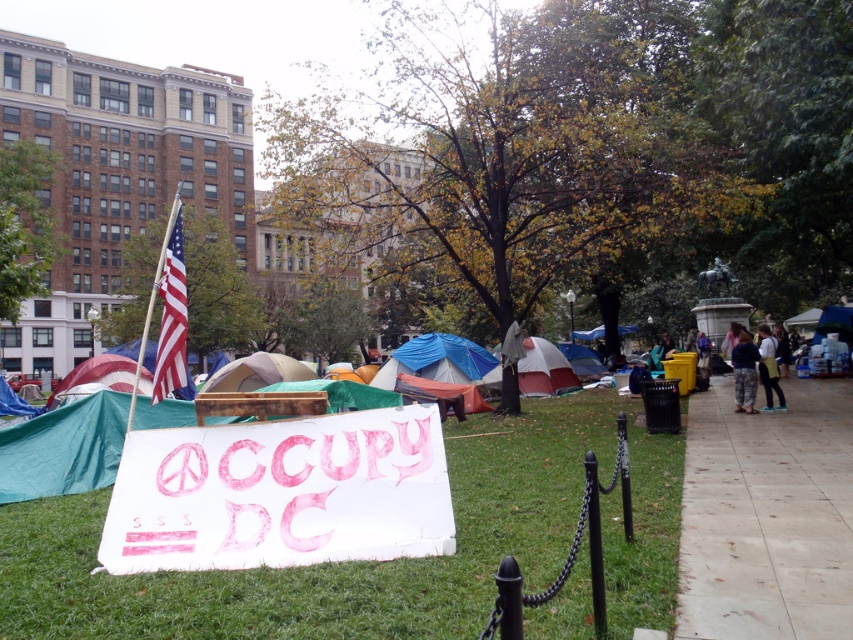
You are a photographer trying to capture the entire scene of the protest in the park. You notice the american flag at upper left and the beige canvas tent at center. Which object should you focus on first to ensure both are in frame without moving the camera?

The american flag at upper left is bigger than the beige canvas tent at center, so you should focus on the american flag at upper left first to ensure both are in frame without moving the camera.

You are a protester who wants to set up a new tent. You see the smooth concrete pavement at right and the blue fabric tent at center. Which surface would be more suitable for placing a tent?

The blue fabric tent at center is already placed on the grassy area, which is more suitable for tents than the smooth concrete pavement at right. Therefore, the grassy area where the blue fabric tent at center is located is better for setting up a tent.